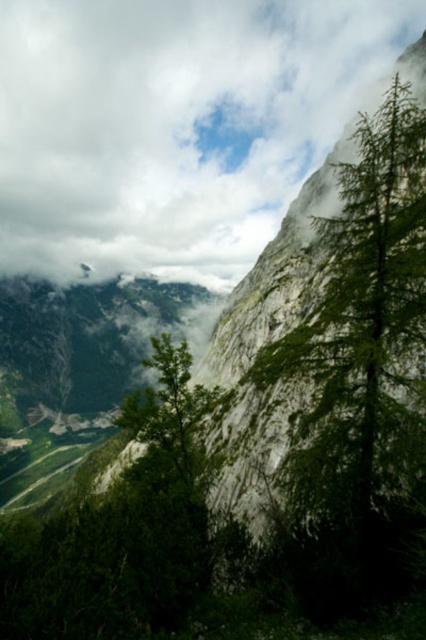
You are a hiker standing in the valley looking at the white fluffy cloud at upper center and the green leafy tree at right. Which object appears larger in the sky?

The white fluffy cloud at upper center might be wider than the green leafy tree at right, so it could appear larger in the sky.

You are an airplane passenger looking out the window. You see a white fluffy cloud at upper center and a green leafy tree at right. Which object is closer to the right edge of your window view?

The white fluffy cloud at upper center is positioned on the right side of green leafy tree at right, so the white fluffy cloud at upper center is closer to the right edge of the window view.

You are a hiker standing at the dense cluster of coniferous trees in the foreground of the image. You see a point marked at coordinate (173, 125). What is the nearest object to that point?

The point at (173, 125) is on the white fluffy cloud at upper center, so the nearest object to that point is the white fluffy cloud at upper center.